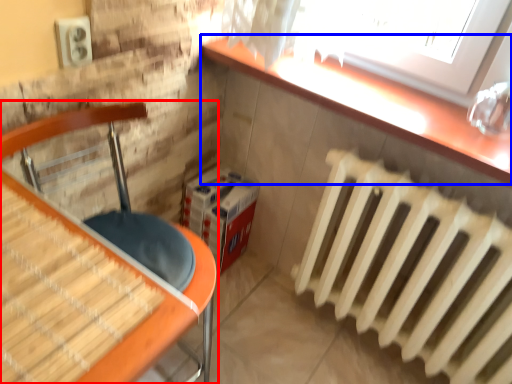
Question: Which point is further to the camera, furniture (highlighted by a red box) or counter top (highlighted by a blue box)?

Choices:
 (A) furniture
 (B) counter top

Answer: (B)